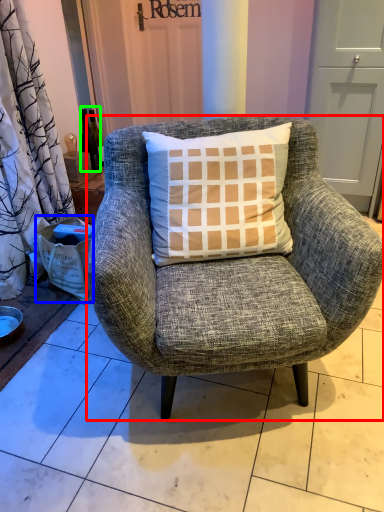
Question: Based on their relative distances, which object is nearer to chair (highlighted by a red box)? Choose from box (highlighted by a blue box) and bottle (highlighted by a green box).

Choices:
 (A) box
 (B) bottle

Answer: (A)